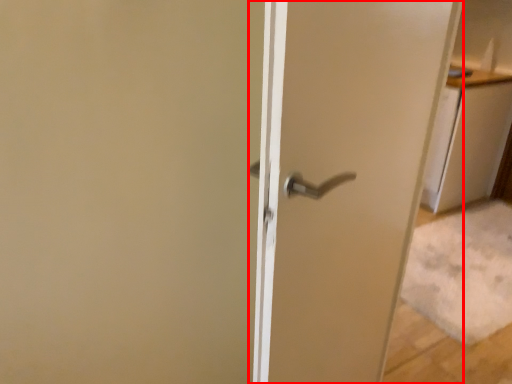
Question: Where is door (annotated by the red box) located in relation to cabinetry in the image?

Choices:
 (A) left
 (B) right

Answer: (A)